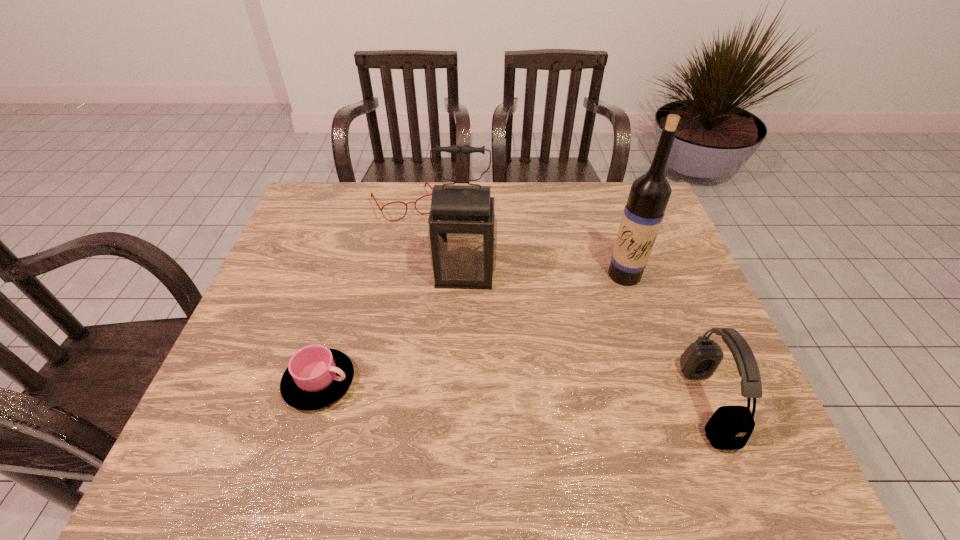
Where is `vacant space in between the rightmost object and the wine bottle`? Image resolution: width=960 pixels, height=540 pixels. vacant space in between the rightmost object and the wine bottle is located at coordinates pyautogui.click(x=665, y=339).

This screenshot has width=960, height=540. Identify the location of empty space between the wine bottle and the cup. (472, 328).

In order to click on object that ranks as the third closest to the cup in this screenshot , I will do `click(649, 194)`.

You are a GUI agent. You are given a task and a screenshot of the screen. Output one action in this format:
    pyautogui.click(x=<x>, y=<y>)
    Task: Click on the object that stands as the third closest to the headset
    Image resolution: width=960 pixels, height=540 pixels.
    Given the screenshot: What is the action you would take?
    pyautogui.click(x=316, y=377)

Find the location of a particular element. The height and width of the screenshot is (540, 960). free space that satisfies the following two spatial constraints: 1. on the back side of the fourth object from left to right; 2. on the right side of the lantern is located at coordinates (465, 275).

Find the location of a particular element. This screenshot has width=960, height=540. free spot that satisfies the following two spatial constraints: 1. on the front side of the farthest object; 2. on the left side of the wine bottle is located at coordinates (391, 275).

Find the location of a particular element. The height and width of the screenshot is (540, 960). vacant point that satisfies the following two spatial constraints: 1. on the front side of the second object from right to left; 2. on the headband of the third tallest object is located at coordinates (666, 403).

You are a GUI agent. You are given a task and a screenshot of the screen. Output one action in this format:
    pyautogui.click(x=<x>, y=<y>)
    Task: Click on the free point that satisfies the following two spatial constraints: 1. on the front side of the headset; 2. on the headband of the spectacles
    This screenshot has height=540, width=960.
    Given the screenshot: What is the action you would take?
    pyautogui.click(x=365, y=403)